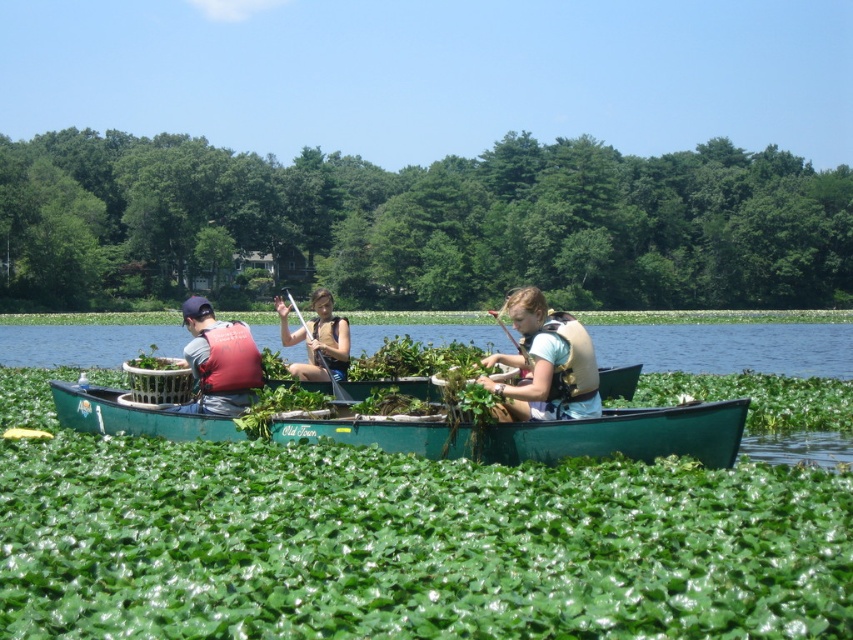
Is green leafy plants at center bigger than matte red life vest at left?

Yes, green leafy plants at center is bigger than matte red life vest at left.

This screenshot has width=853, height=640. Find the location of `green leafy plants at center`. green leafy plants at center is located at coordinates (421, 225).

Where is `green leafy plants at center`? Image resolution: width=853 pixels, height=640 pixels. green leafy plants at center is located at coordinates (421, 225).

Does green leafy plants at center have a greater height compared to green plastic canoe at center?

Yes, green leafy plants at center is taller than green plastic canoe at center.

Is green leafy plants at center smaller than green plastic canoe at center?

Actually, green leafy plants at center might be larger than green plastic canoe at center.

At what (x,y) coordinates should I click in order to perform the action: click on green leafy plants at center. Please return your answer as a coordinate pair (x, y). Looking at the image, I should click on (421, 225).

Does green plastic canoe at center have a smaller size compared to matte red life vest at left?

Yes, green plastic canoe at center is smaller than matte red life vest at left.

Does green plastic canoe at center lie in front of matte red life vest at left?

That is False.

Identify the location of green plastic canoe at center. (546, 435).